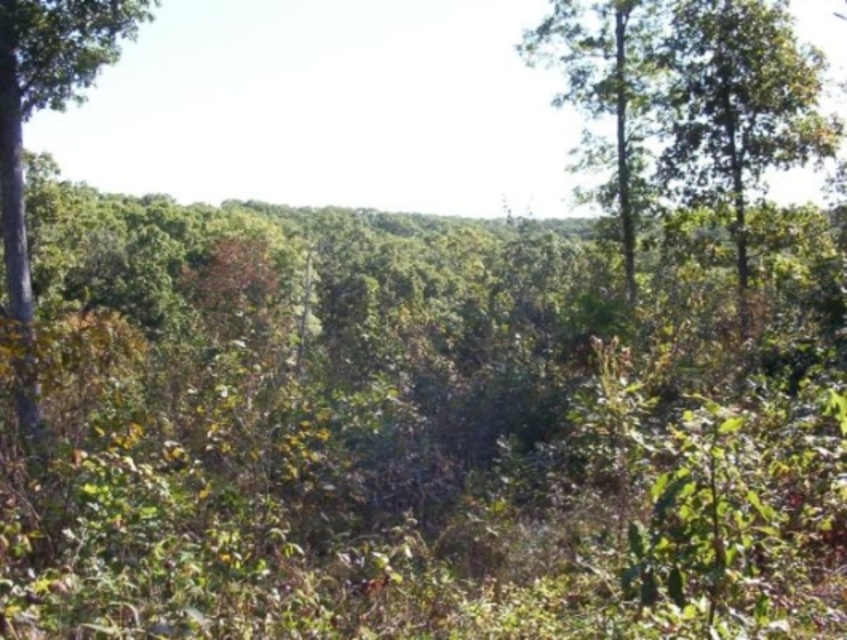
You are a hiker who wants to find the narrowest path between the green leafy tree at upper right and the green leafy tree at left. Which tree should you approach to find the narrowest path?

The green leafy tree at upper right is thinner than the green leafy tree at left, so the narrowest path would likely be near the green leafy tree at upper right.

You are a hiker trying to navigate through the forest. You notice two green leafy trees in your path. The first is the green leafy tree at upper right, and the second is the green leafy tree at left. Which tree is positioned higher in the image from your viewpoint?

The green leafy tree at upper right is positioned higher in the image than the green leafy tree at left.